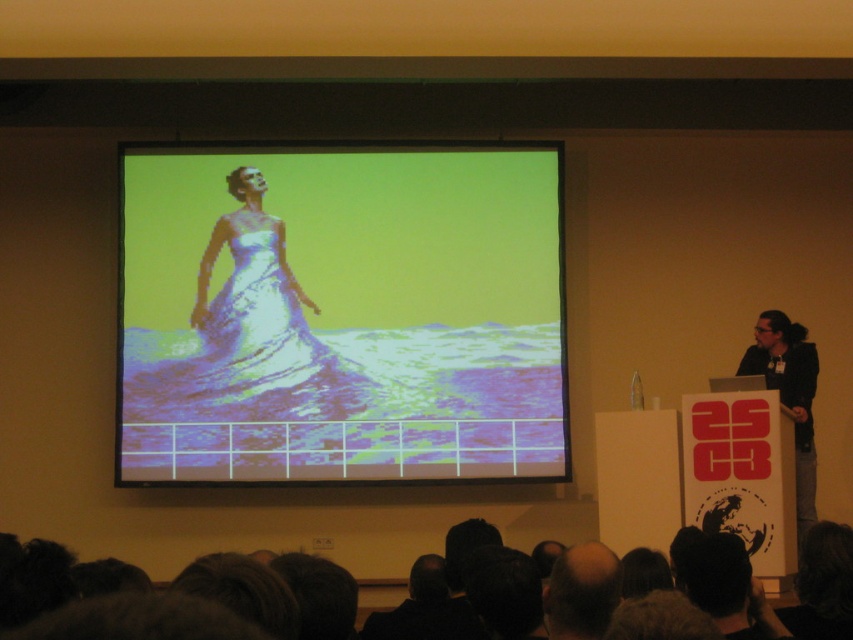
You are an event organizer who needs to place a small decorative plant at point (788,396). According to the scene, what object is located at that point?

At point (788,396) lies black fabric at right.

You are an event coordinator setting up for a presentation. You notice the white glossy dress at upper center and the black fabric at right in the projected image. Which object is closer to the front of the projection screen?

The white glossy dress at upper center is closer to the front of the projection screen because the black fabric at right is behind it.